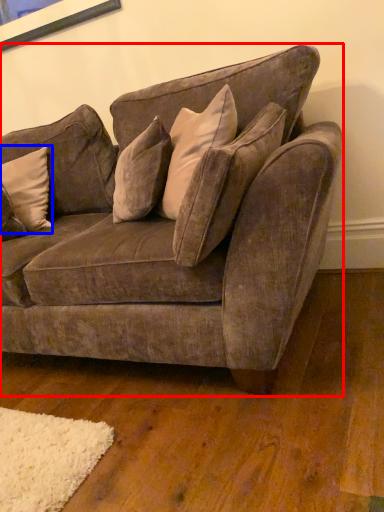
Question: Which object appears closest to the camera in this image, studio couch (highlighted by a red box) or pillow (highlighted by a blue box)?

Choices:
 (A) studio couch
 (B) pillow

Answer: (A)